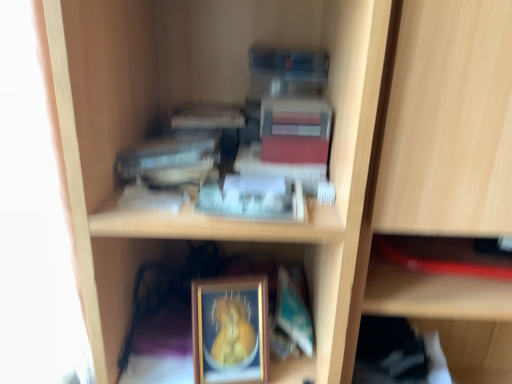
Question: Which direction should I rotate to look at teal matte paperback book at lower center, which is counted as the 3th paperback book, starting from the top, — up or down?

Choices:
 (A) up
 (B) down

Answer: (B)

Question: Is matte red paperback book at upper center, arranged as the 3th paperback book when ordered from the bottom, positioned in front of teal matte paperback book at lower center, which is counted as the 3th paperback book, starting from the top?

Choices:
 (A) no
 (B) yes

Answer: (B)

Question: Does matte red paperback book at upper center, marked as the second paperback book in a left-to-right arrangement, appear on the right side of teal matte paperback book at lower center, which is counted as the 3th paperback book, starting from the top?

Choices:
 (A) yes
 (B) no

Answer: (B)

Question: Can teal matte paperback book at lower center, which is counted as the 3th paperback book, starting from the top, be found inside matte red paperback book at upper center, arranged as the 3th paperback book when ordered from the bottom?

Choices:
 (A) no
 (B) yes

Answer: (A)

Question: From the image's perspective, is matte red paperback book at upper center, the 1th paperback book when ordered from top to bottom, located above teal matte paperback book at lower center, which appears as the first paperback book when ordered from the bottom?

Choices:
 (A) no
 (B) yes

Answer: (B)

Question: Would you say matte red paperback book at upper center, arranged as the 3th paperback book when ordered from the bottom, is outside teal matte paperback book at lower center, which is counted as the 3th paperback book, starting from the top?

Choices:
 (A) no
 (B) yes

Answer: (B)

Question: Is matte red paperback book at upper center, the 1th paperback book when ordered from top to bottom, turned away from teal matte paperback book at lower center, which is counted as the 3th paperback book, starting from the top?

Choices:
 (A) no
 (B) yes

Answer: (A)

Question: Is matte red paperback book at upper center, arranged as the 3th paperback book when ordered from the bottom, to the right of gold-framed picture at lower center from the viewer's perspective?

Choices:
 (A) no
 (B) yes

Answer: (B)

Question: Is matte red paperback book at upper center, marked as the second paperback book in a left-to-right arrangement, facing away from gold-framed picture at lower center?

Choices:
 (A) yes
 (B) no

Answer: (B)

Question: Does matte red paperback book at upper center, the 1th paperback book when ordered from top to bottom, come behind gold-framed picture at lower center?

Choices:
 (A) yes
 (B) no

Answer: (B)

Question: Is matte red paperback book at upper center, the 2th paperback book in the right-to-left sequence, wider than gold-framed picture at lower center?

Choices:
 (A) yes
 (B) no

Answer: (A)

Question: Is gold-framed picture at lower center surrounded by matte red paperback book at upper center, marked as the second paperback book in a left-to-right arrangement?

Choices:
 (A) yes
 (B) no

Answer: (B)

Question: Considering the relative sizes of matte red paperback book at upper center, marked as the second paperback book in a left-to-right arrangement, and gold-framed picture at lower center in the image provided, is matte red paperback book at upper center, marked as the second paperback book in a left-to-right arrangement, bigger than gold-framed picture at lower center?

Choices:
 (A) yes
 (B) no

Answer: (B)

Question: Is there a large distance between hardcover book at upper center, which is the second paperback book in bottom-to-top order, and gold-framed picture at lower center?

Choices:
 (A) no
 (B) yes

Answer: (A)